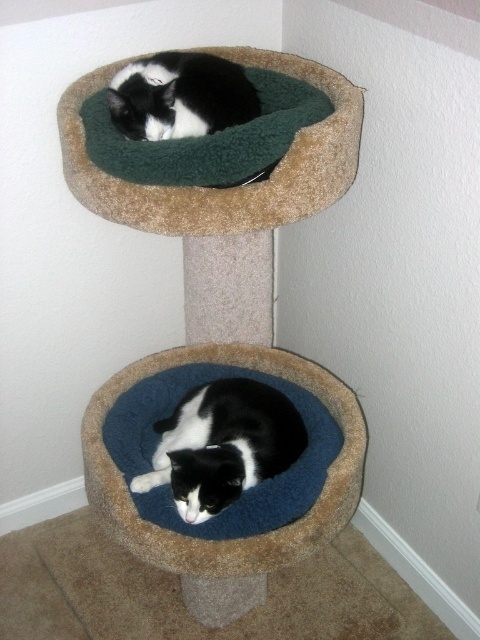
What do you see at coordinates (225, 188) in the screenshot?
I see `green plush cat bed at upper center` at bounding box center [225, 188].

Consider the image. Between green plush cat bed at upper center and black and white fur cat at lower center, which one appears on the left side from the viewer's perspective?

Positioned to the left is green plush cat bed at upper center.

Where is `green plush cat bed at upper center`? green plush cat bed at upper center is located at coordinates (225, 188).

Identify the location of green plush cat bed at upper center. (225, 188).

Can you confirm if green plush cat bed at upper center is positioned above black fuzzy cat at upper center?

No, green plush cat bed at upper center is not above black fuzzy cat at upper center.

At what (x,y) coordinates should I click in order to perform the action: click on green plush cat bed at upper center. Please return your answer as a coordinate pair (x, y). This screenshot has height=640, width=480. Looking at the image, I should click on (225, 188).

Where is `green plush cat bed at upper center`? green plush cat bed at upper center is located at coordinates (225, 188).

In the scene shown: Between black and white fur cat at lower center and black fuzzy cat at upper center, which one appears on the left side from the viewer's perspective?

From the viewer's perspective, black fuzzy cat at upper center appears more on the left side.

Can you confirm if black and white fur cat at lower center is positioned below black fuzzy cat at upper center?

Indeed, black and white fur cat at lower center is positioned under black fuzzy cat at upper center.

Is point (290, 419) behind point (111, 100)?

Yes, point (290, 419) is behind point (111, 100).

Where is `black and white fur cat at lower center`? The width and height of the screenshot is (480, 640). black and white fur cat at lower center is located at coordinates (223, 444).